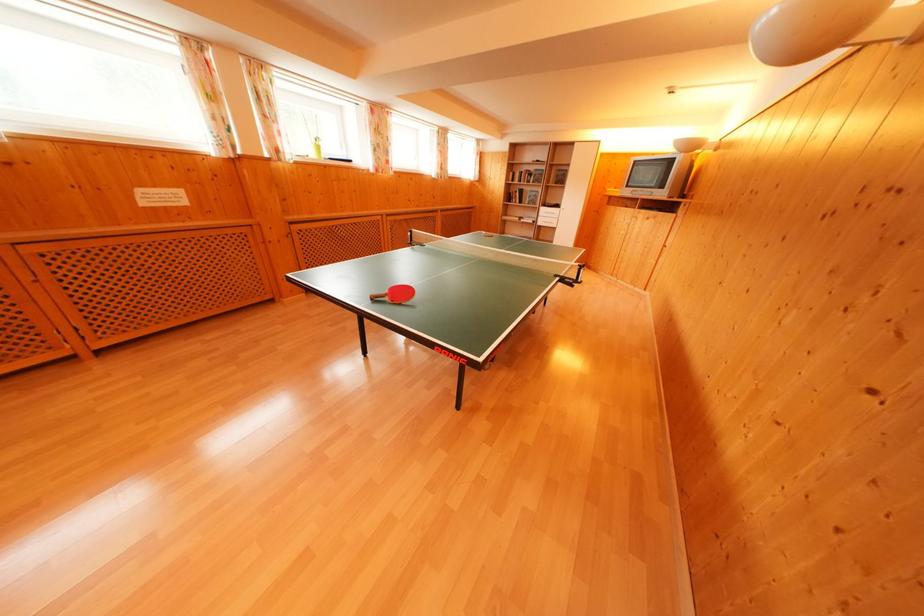
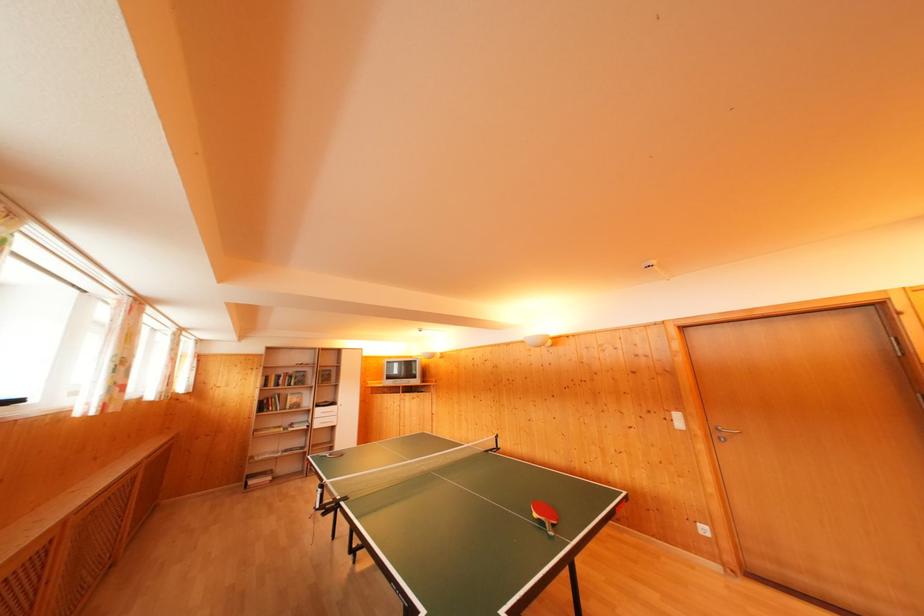
The point at (529, 174) is marked in the first image. Where is the corresponding point in the second image?

(286, 377)